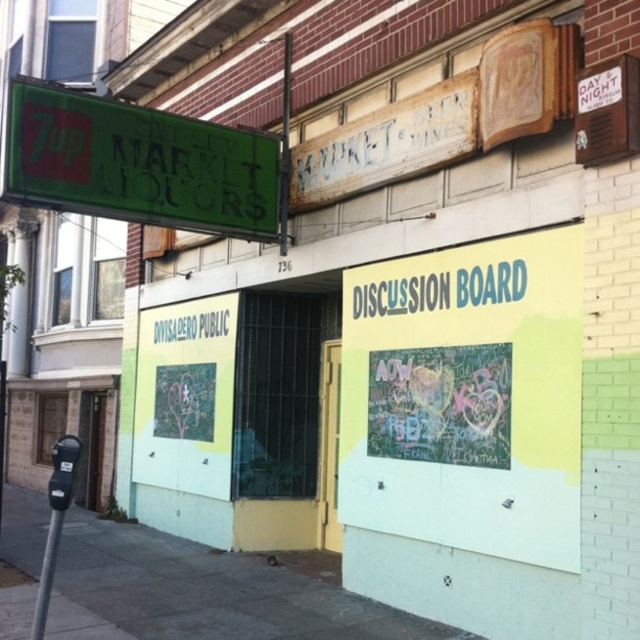
You are a delivery person trying to park your bike between the blue plastic discussion board at center and the metallic gray parking meter at lower left. Can you fit your bike there if the bike is 1.2 meters wide?

The blue plastic discussion board at center might be wider than metallic gray parking meter at lower left, so the available space between them is uncertain. Without knowing the exact width of the objects, it is impossible to determine if the bike will fit.

You are a customer entering the 7up Market Liquors store and notice two signs outside. The green matte signboard at upper left and the blue plastic discussion board at center. Which sign is positioned to the left when facing the store?

The green matte signboard at upper left is positioned to the left of the blue plastic discussion board at center when facing the store.

You are a pedestrian trying to read the blue plastic discussion board at center. There is a metallic gray parking meter at lower left. Which object is closer to you as you face the storefront?

The blue plastic discussion board at center is closer to you because the metallic gray parking meter at lower left is behind it.